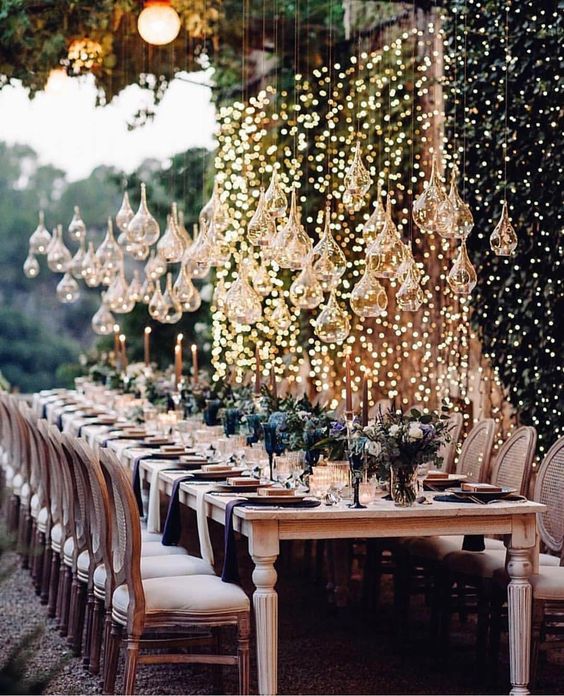
Where is `table leg`? Image resolution: width=564 pixels, height=696 pixels. table leg is located at coordinates (268, 607).